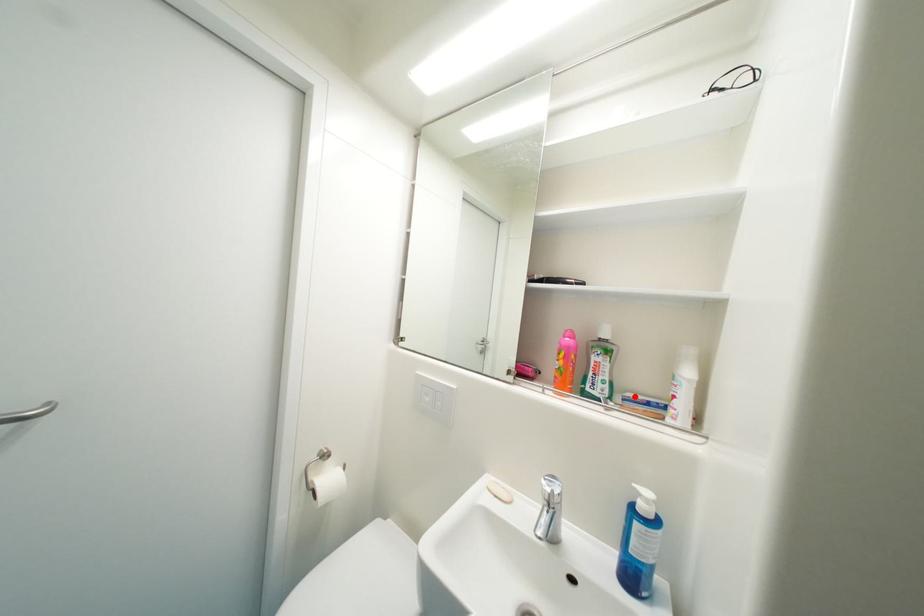
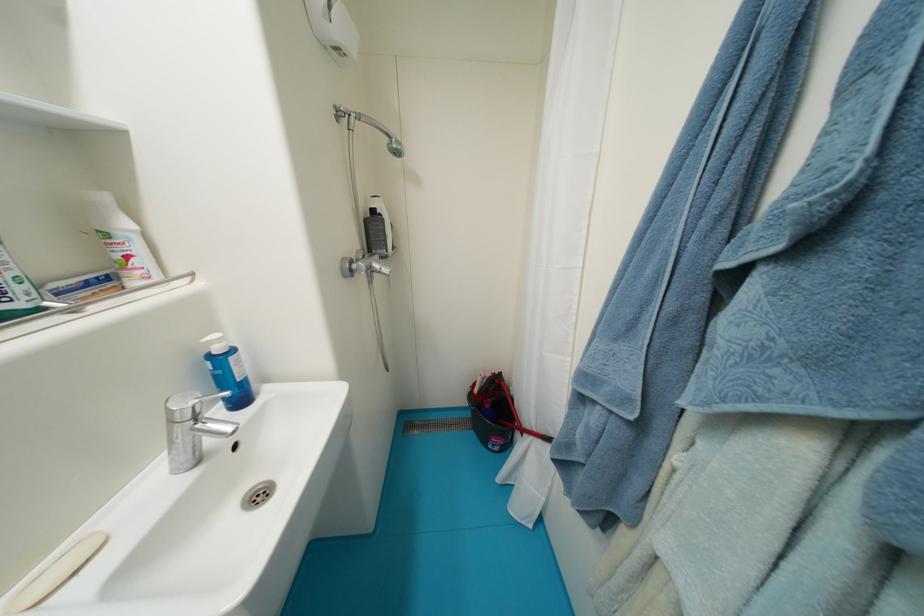
In the second image, find the point that corresponds to the highlighted location in the first image.

(61, 286)